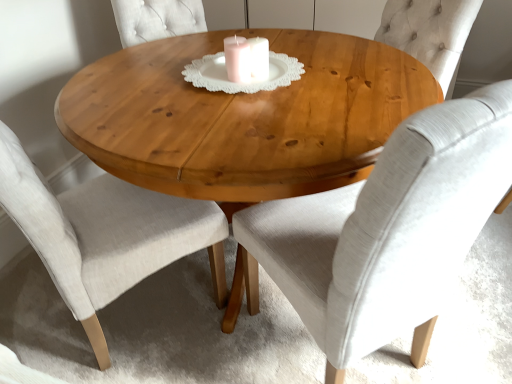
Question: Is natural wood table at center located within light beige fabric chair at center, the second chair from the right?

Choices:
 (A) no
 (B) yes

Answer: (A)

Question: Considering the relative sizes of light beige fabric chair at center, the second chair from the right, and natural wood table at center in the image provided, is light beige fabric chair at center, the second chair from the right, wider than natural wood table at center?

Choices:
 (A) no
 (B) yes

Answer: (A)

Question: Is light beige fabric chair at center, positioned as the first chair in left-to-right order, at the right side of natural wood table at center?

Choices:
 (A) no
 (B) yes

Answer: (A)

Question: Is light beige fabric chair at center, positioned as the first chair in left-to-right order, taller than natural wood table at center?

Choices:
 (A) yes
 (B) no

Answer: (A)

Question: From the image's perspective, does light beige fabric chair at center, positioned as the first chair in left-to-right order, appear lower than natural wood table at center?

Choices:
 (A) no
 (B) yes

Answer: (B)

Question: Can you confirm if light beige fabric chair at center, positioned as the first chair in left-to-right order, is smaller than natural wood table at center?

Choices:
 (A) yes
 (B) no

Answer: (A)

Question: Considering the relative positions of light gray fabric chair at center, which is counted as the 1th chair, starting from the right, and natural wood table at center in the image provided, is light gray fabric chair at center, which is counted as the 1th chair, starting from the right, to the right of natural wood table at center from the viewer's perspective?

Choices:
 (A) yes
 (B) no

Answer: (A)

Question: Would you consider light gray fabric chair at center, which is counted as the 1th chair, starting from the right, to be distant from natural wood table at center?

Choices:
 (A) no
 (B) yes

Answer: (A)

Question: Does light gray fabric chair at center, which is counted as the 1th chair, starting from the right, come behind natural wood table at center?

Choices:
 (A) yes
 (B) no

Answer: (B)

Question: Is light gray fabric chair at center, which is counted as the 1th chair, starting from the right, smaller than natural wood table at center?

Choices:
 (A) no
 (B) yes

Answer: (B)

Question: Does light gray fabric chair at center, which is counted as the 1th chair, starting from the right, have a greater height compared to natural wood table at center?

Choices:
 (A) no
 (B) yes

Answer: (B)

Question: From the image's perspective, is light gray fabric chair at center, which is counted as the 1th chair, starting from the right, under natural wood table at center?

Choices:
 (A) no
 (B) yes

Answer: (B)

Question: From a real-world perspective, is natural wood table at center positioned over light gray fabric chair at center, which is counted as the 1th chair, starting from the right, based on gravity?

Choices:
 (A) yes
 (B) no

Answer: (B)